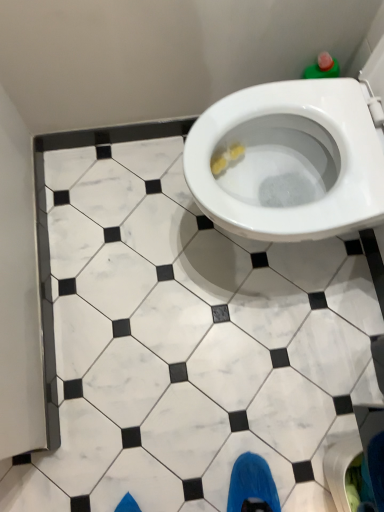
Where is `unoccupied area in front of white glossy toilet at center`? This screenshot has height=512, width=384. unoccupied area in front of white glossy toilet at center is located at coordinates (263, 354).